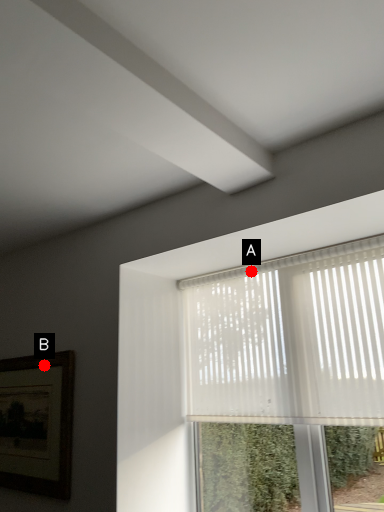
Question: Two points are circled on the image, labeled by A and B beside each circle. Which point is farther to the camera?

Choices:
 (A) A is further
 (B) B is further

Answer: (B)